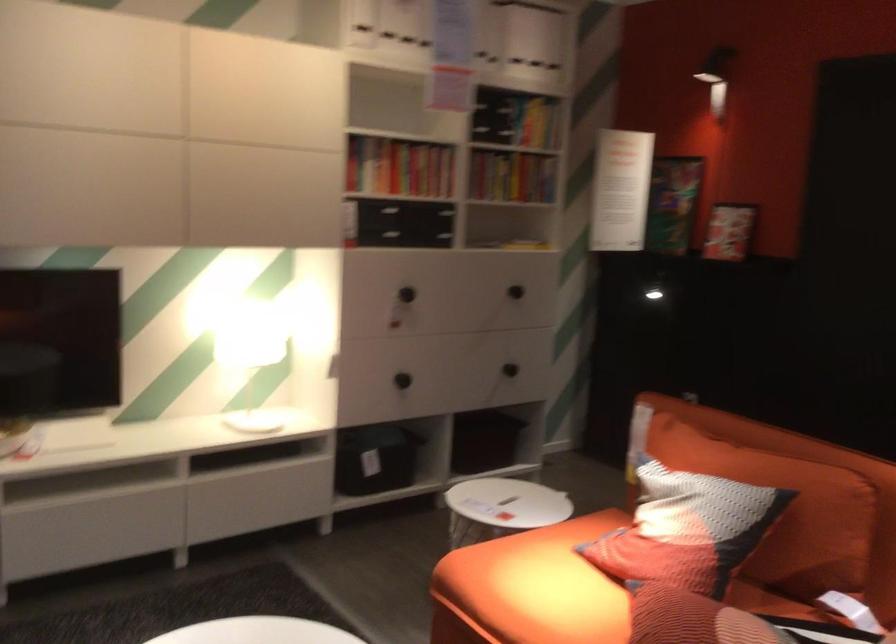
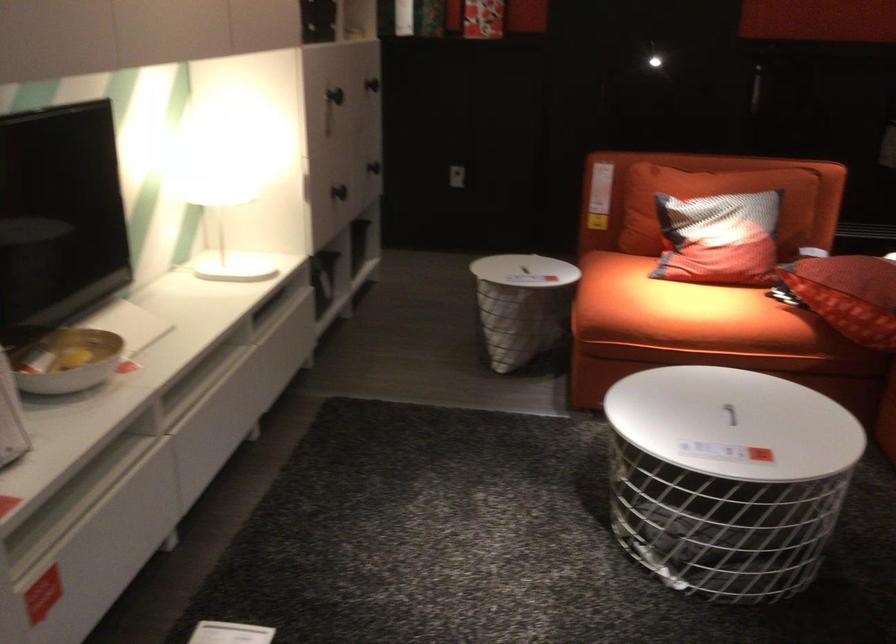
In the second image, find the point that corresponds to [640,529] in the first image.

(719, 239)